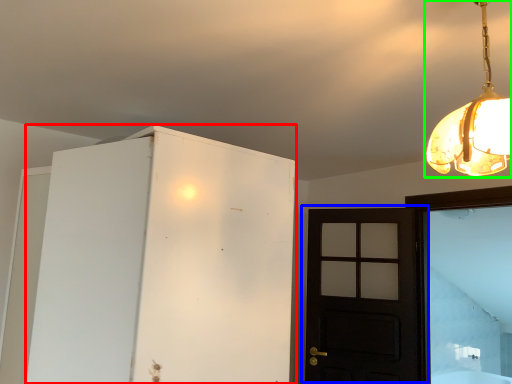
Question: Considering the real-world distances, which object is closest to cabinetry (highlighted by a red box)? door (highlighted by a blue box) or lamp (highlighted by a green box).

Choices:
 (A) door
 (B) lamp

Answer: (B)